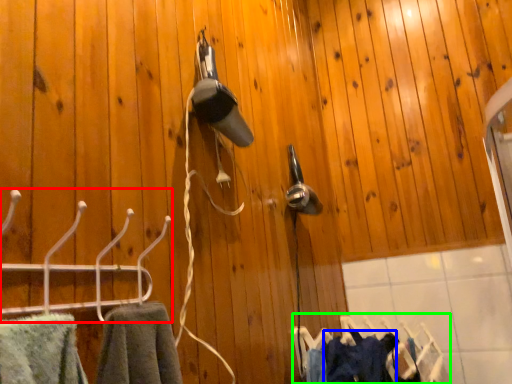
Question: Which object is positioned farthest from hanger (highlighted by a red box)? Select from clothing (highlighted by a blue box) and laundry (highlighted by a green box).

Choices:
 (A) clothing
 (B) laundry

Answer: (B)